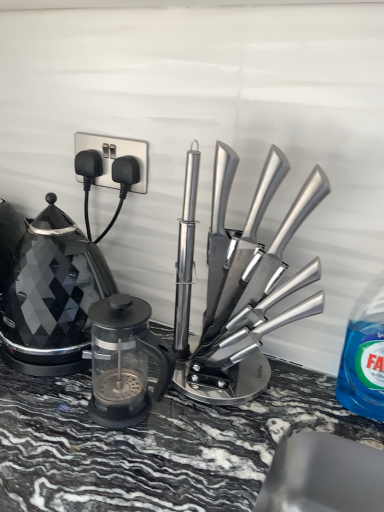
Question: Is black glass kettle at left bigger or smaller than silver metallic plug at upper left?

Choices:
 (A) big
 (B) small

Answer: (A)

Question: Is point (44, 315) closer or farther from the camera than point (140, 155)?

Choices:
 (A) closer
 (B) farther

Answer: (A)

Question: Which is nearer to the polished stainless steel knife block at center, positioned as the second kitchen appliance in left-to-right order?

Choices:
 (A) black glass kettle at left
 (B) blue translucent liquid at right
 (C) silver metallic plug at upper left
 (D) transparent glass french press at center, acting as the first kitchen appliance starting from the left

Answer: (D)

Question: Based on their relative distances, which object is nearer to the silver metallic plug at upper left?

Choices:
 (A) polished stainless steel knife block at center, positioned as the second kitchen appliance in left-to-right order
 (B) transparent glass french press at center, which is counted as the second kitchen appliance, starting from the right
 (C) black glass kettle at left
 (D) blue translucent liquid at right

Answer: (C)